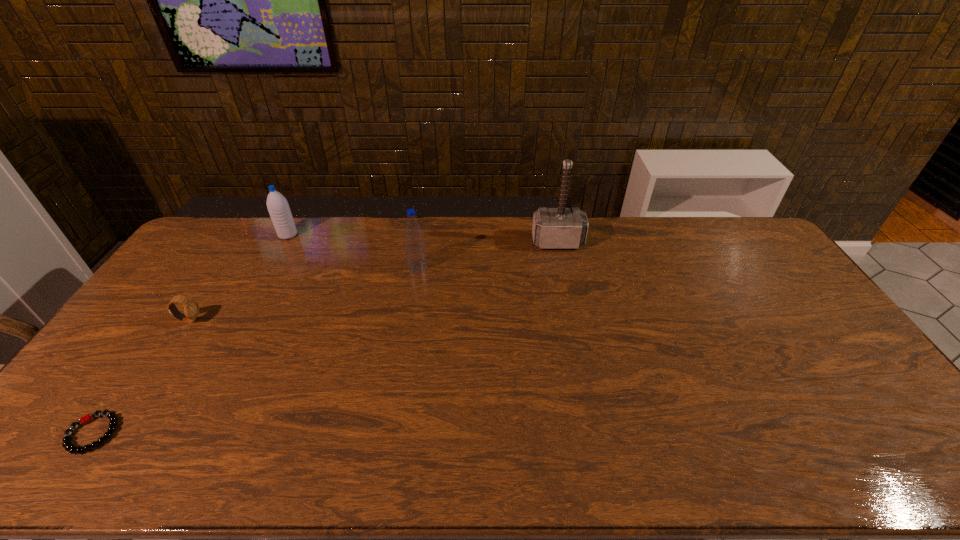
Where is `vacant space located 0.110m for striking with the head of the hammer`? The width and height of the screenshot is (960, 540). vacant space located 0.110m for striking with the head of the hammer is located at coordinates (564, 272).

The width and height of the screenshot is (960, 540). In order to click on vacant point located on the back of the third nearest object in this screenshot , I will do `click(425, 217)`.

You are a GUI agent. You are given a task and a screenshot of the screen. Output one action in this format:
    pyautogui.click(x=<x>, y=<y>)
    Task: Click on the vacant space positioned on the right of the farther water bottle
    
    Given the screenshot: What is the action you would take?
    pyautogui.click(x=332, y=235)

At what (x,y) coordinates should I click in order to perform the action: click on vacant space located 0.200m on the face of the second shortest object. Please return your answer as a coordinate pair (x, y). The image size is (960, 540). Looking at the image, I should click on (266, 321).

I want to click on vacant space located 0.060m on the back of the nearest object, so click(122, 392).

Locate an element on the screen. The width and height of the screenshot is (960, 540). hammer that is at the far edge is located at coordinates (553, 228).

The height and width of the screenshot is (540, 960). In order to click on water bottle that is positioned at the far edge in this screenshot , I will do `click(277, 205)`.

Where is `object that is positioned at the near edge`? object that is positioned at the near edge is located at coordinates (67, 443).

You are a GUI agent. You are given a task and a screenshot of the screen. Output one action in this format:
    pyautogui.click(x=<x>, y=<y>)
    Task: Click on the watch that is at the left edge
    This screenshot has width=960, height=540.
    Given the screenshot: What is the action you would take?
    pyautogui.click(x=191, y=308)

Where is `bracelet present at the left edge`? Image resolution: width=960 pixels, height=540 pixels. bracelet present at the left edge is located at coordinates (67, 443).